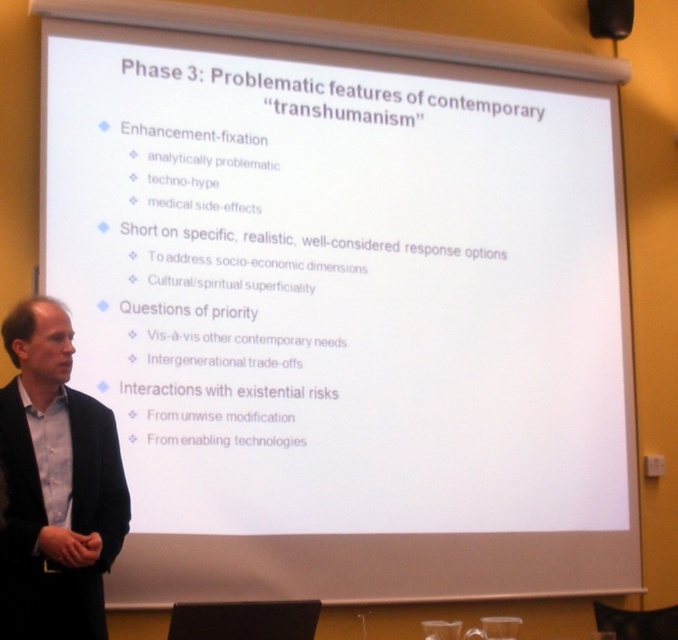
Question: Which of the following is the closest to the observer?

Choices:
 (A) black matte speaker at upper right
 (B) light blue shirt at left

Answer: (B)

Question: Can you confirm if light blue shirt at left is smaller than black matte speaker at upper right?

Choices:
 (A) yes
 (B) no

Answer: (B)

Question: Is light blue shirt at left bigger than black matte speaker at upper right?

Choices:
 (A) no
 (B) yes

Answer: (B)

Question: From the image, what is the correct spatial relationship of light blue shirt at left in relation to black matte speaker at upper right?

Choices:
 (A) below
 (B) above

Answer: (A)